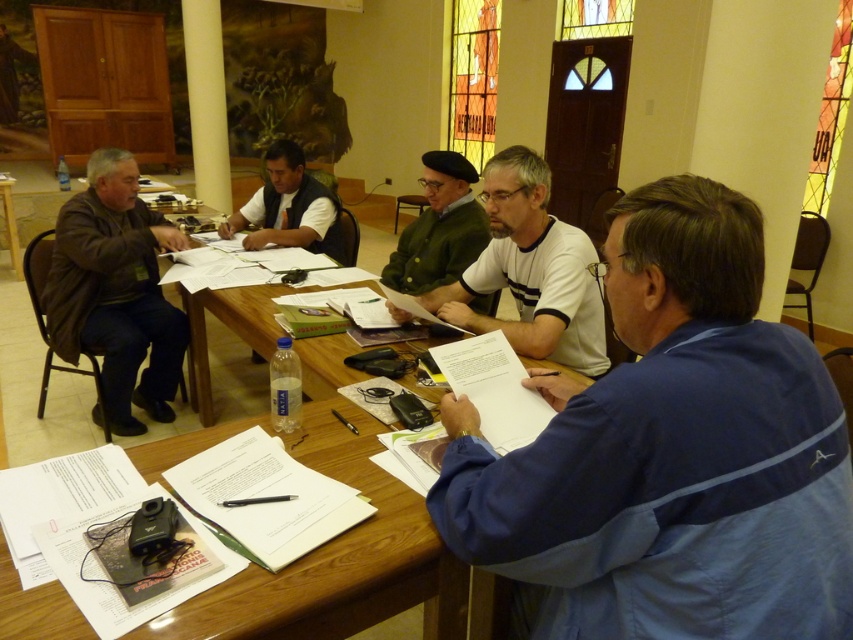
Question: Does blue fabric shirt at center appear on the left side of green matte jacket at center?

Choices:
 (A) yes
 (B) no

Answer: (B)

Question: Does brown leather jacket at left have a greater width compared to white cotton shirt at center?

Choices:
 (A) no
 (B) yes

Answer: (A)

Question: Estimate the real-world distances between objects in this image. Which object is closer to the white cotton shirt at center?

Choices:
 (A) green matte jacket at center
 (B) blue fabric shirt at center

Answer: (A)

Question: Which object is the farthest from the matte black vest at center?

Choices:
 (A) wooden table at center
 (B) white cotton shirt at center

Answer: (A)

Question: Can you confirm if matte black vest at center is positioned above wooden table at center?

Choices:
 (A) yes
 (B) no

Answer: (B)

Question: Which object appears farthest from the camera in this image?

Choices:
 (A) wooden table at center
 (B) matte black vest at center

Answer: (A)